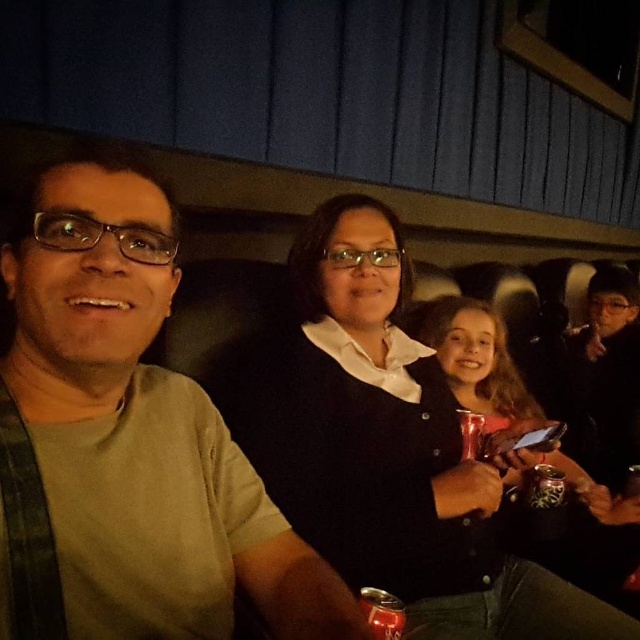
Question: Which point is closer to the camera?

Choices:
 (A) click(x=600, y=486)
 (B) click(x=330, y=244)

Answer: (B)

Question: Where is matte green shirt at left located in relation to matte black shirt at center in the image?

Choices:
 (A) right
 (B) left

Answer: (B)

Question: Is the position of matte green shirt at left less distant than that of black matte sweater at center?

Choices:
 (A) yes
 (B) no

Answer: (A)

Question: Among these points, which one is farthest from the camera?

Choices:
 (A) (520, 600)
 (B) (131, 506)
 (C) (573, 515)

Answer: (C)

Question: Can you confirm if matte green shirt at left is positioned above matte black shirt at center?

Choices:
 (A) yes
 (B) no

Answer: (A)

Question: Which of the following is the farthest from the observer?

Choices:
 (A) matte green shirt at left
 (B) black matte sweater at center
 (C) matte black shirt at center

Answer: (C)